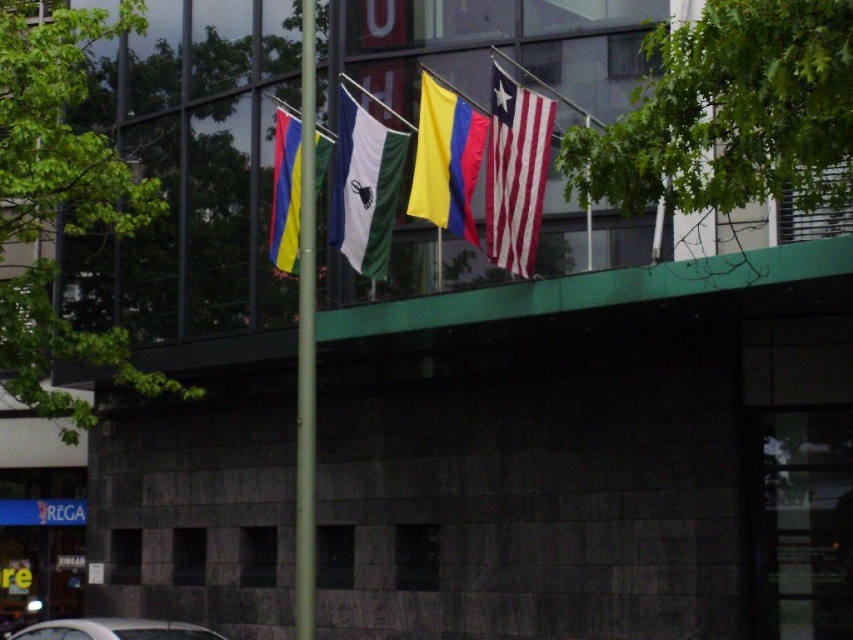
Question: Which object is the farthest from the white matte flag at center?

Choices:
 (A) multicolored fabric flag at center
 (B) metallic pole at center
 (C) white striped flag at upper right
 (D) yellow fabric flag at center

Answer: (B)

Question: Can you confirm if white striped flag at upper right is positioned below metallic pole at center?

Choices:
 (A) yes
 (B) no

Answer: (B)

Question: Can you confirm if white striped flag at upper right is wider than white matte flag at center?

Choices:
 (A) yes
 (B) no

Answer: (B)

Question: Where is metallic pole at center located in relation to white matte flag at center in the image?

Choices:
 (A) above
 (B) below

Answer: (B)

Question: Which point is closer to the camera?

Choices:
 (A) (328, 234)
 (B) (300, 531)

Answer: (B)

Question: Which object appears farthest from the camera in this image?

Choices:
 (A) multicolored fabric flag at center
 (B) yellow fabric flag at center
 (C) white matte flag at center
 (D) white striped flag at upper right

Answer: (A)